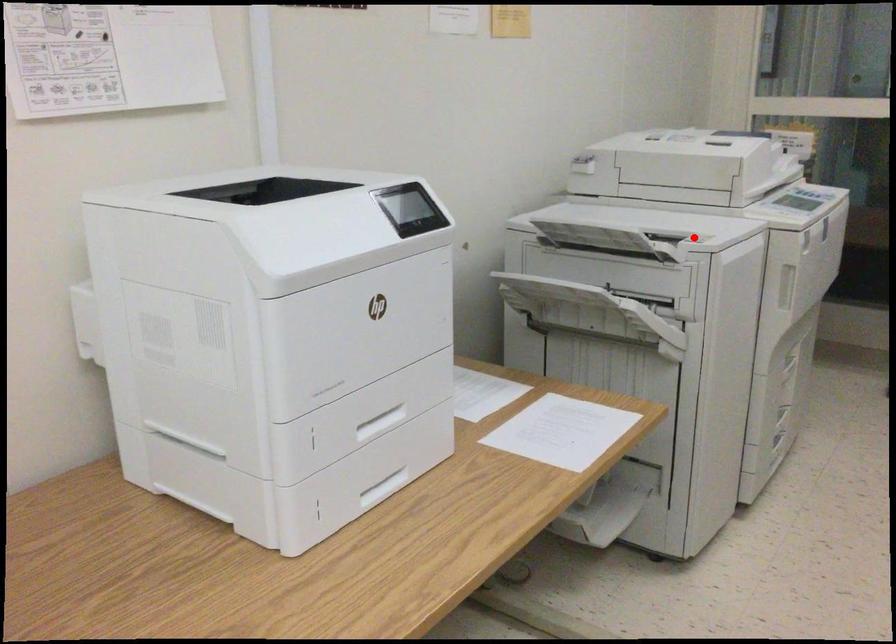
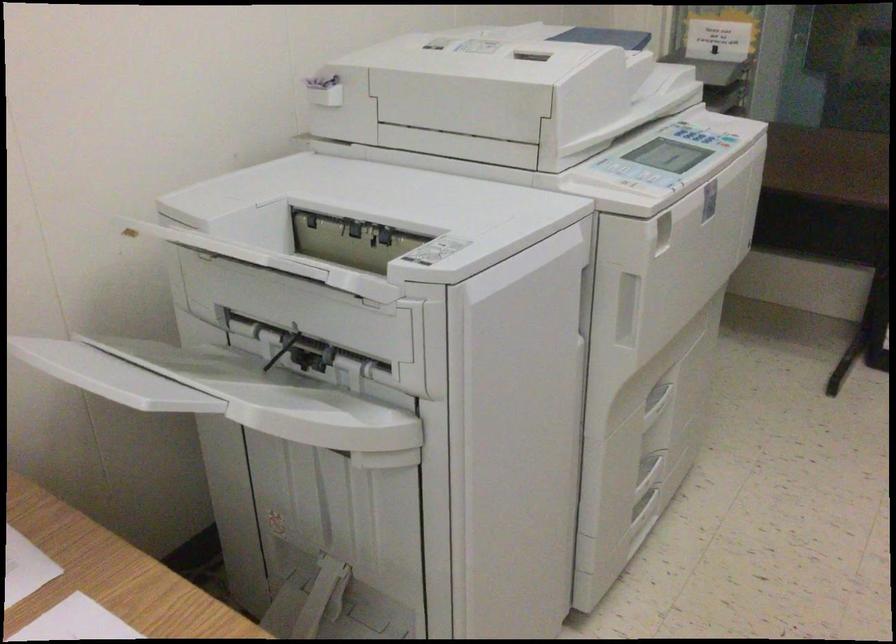
Question: I am providing you with two images of the same scene from different viewpoints. In image1, a red point is highlighted. Considering the same 3D point in image2, which of the following is correct?

Choices:
 (A) It is closer
 (B) It is farther

Answer: (A)